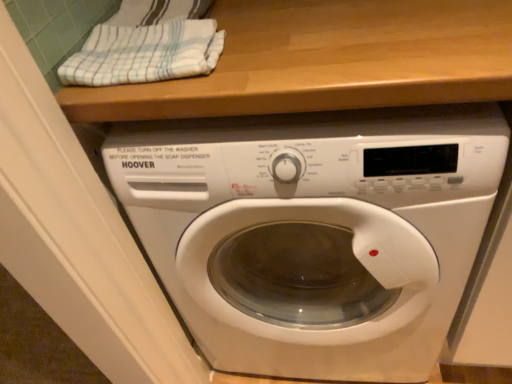
Where is `white glossy washing machine at center`? Image resolution: width=512 pixels, height=384 pixels. white glossy washing machine at center is located at coordinates (315, 231).

The width and height of the screenshot is (512, 384). What do you see at coordinates (315, 231) in the screenshot?
I see `white glossy washing machine at center` at bounding box center [315, 231].

Image resolution: width=512 pixels, height=384 pixels. Describe the element at coordinates (145, 53) in the screenshot. I see `white striped towel at upper left` at that location.

You are a GUI agent. You are given a task and a screenshot of the screen. Output one action in this format:
    pyautogui.click(x=<x>, y=<y>)
    Task: Click on the white striped towel at upper left
    This screenshot has height=384, width=512.
    Given the screenshot: What is the action you would take?
    pyautogui.click(x=145, y=53)

Find the location of a particular element. The width and height of the screenshot is (512, 384). white glossy washing machine at center is located at coordinates (315, 231).

Which object is positioned more to the right, white glossy washing machine at center or white striped towel at upper left?

Positioned to the right is white glossy washing machine at center.

Which is behind, white glossy washing machine at center or white striped towel at upper left?

white striped towel at upper left is more distant.

Is point (145, 136) positioned before point (159, 27)?

Yes.

From the image's perspective, does white glossy washing machine at center appear higher than white striped towel at upper left?

No.

In the scene shown: From a real-world perspective, which is physically above, white glossy washing machine at center or white striped towel at upper left?

white striped towel at upper left.

Which of these two, white glossy washing machine at center or white striped towel at upper left, is wider?

white glossy washing machine at center.

Can you confirm if white glossy washing machine at center is shorter than white striped towel at upper left?

No, white glossy washing machine at center is not shorter than white striped towel at upper left.

Based on their sizes in the image, would you say white glossy washing machine at center is bigger or smaller than white striped towel at upper left?

Considering their sizes, white glossy washing machine at center takes up more space than white striped towel at upper left.

Based on the photo, is white glossy washing machine at center located outside white striped towel at upper left?

Yes, white glossy washing machine at center is not within white striped towel at upper left.

Is white glossy washing machine at center not near white striped towel at upper left?

That's not correct — white glossy washing machine at center is a little close to white striped towel at upper left.

Looking at this image, is white glossy washing machine at center facing away from white striped towel at upper left?

That's not correct — white glossy washing machine at center is not looking away from white striped towel at upper left.

Locate an element on the screen. The height and width of the screenshot is (384, 512). washing machine located in front of the white striped towel at upper left is located at coordinates (315, 231).

Based on their positions, is white striped towel at upper left located to the left or right of white glossy washing machine at center?

In the image, white striped towel at upper left appears on the left side of white glossy washing machine at center.

Between white striped towel at upper left and white glossy washing machine at center, which one is positioned behind?

white striped towel at upper left is further from the camera.

Is point (92, 38) closer or farther from the camera than point (428, 181)?

Point (92, 38) is positioned farther from the camera compared to point (428, 181).

From the image's perspective, is white striped towel at upper left below white glossy washing machine at center?

No.

In the scene shown: From a real-world perspective, is white striped towel at upper left positioned above or below white glossy washing machine at center?

In terms of real-world spatial position, white striped towel at upper left is above white glossy washing machine at center.

Considering the sizes of white striped towel at upper left and white glossy washing machine at center in the image, is white striped towel at upper left wider or thinner than white glossy washing machine at center?

In the image, white striped towel at upper left appears to be more narrow than white glossy washing machine at center.

Considering the sizes of objects white striped towel at upper left and white glossy washing machine at center in the image provided, who is taller, white striped towel at upper left or white glossy washing machine at center?

Standing taller between the two is white glossy washing machine at center.

Between white striped towel at upper left and white glossy washing machine at center, which one has smaller size?

white striped towel at upper left.

Would you say white striped towel at upper left is outside white glossy washing machine at center?

Yes, white striped towel at upper left is outside of white glossy washing machine at center.

Would you consider white striped towel at upper left to be distant from white glossy washing machine at center?

white striped towel at upper left is actually quite close to white glossy washing machine at center.

Is white striped towel at upper left facing away from white glossy washing machine at center?

white striped towel at upper left does not have its back to white glossy washing machine at center.

Where is `clothe that is behind the white glossy washing machine at center`? clothe that is behind the white glossy washing machine at center is located at coordinates (145, 53).

Image resolution: width=512 pixels, height=384 pixels. I want to click on clothe above the white glossy washing machine at center (from the image's perspective), so click(x=145, y=53).

You are a GUI agent. You are given a task and a screenshot of the screen. Output one action in this format:
    pyautogui.click(x=<x>, y=<y>)
    Task: Click on the washing machine located underneath the white striped towel at upper left (from a real-world perspective)
    Image resolution: width=512 pixels, height=384 pixels.
    Given the screenshot: What is the action you would take?
    pyautogui.click(x=315, y=231)